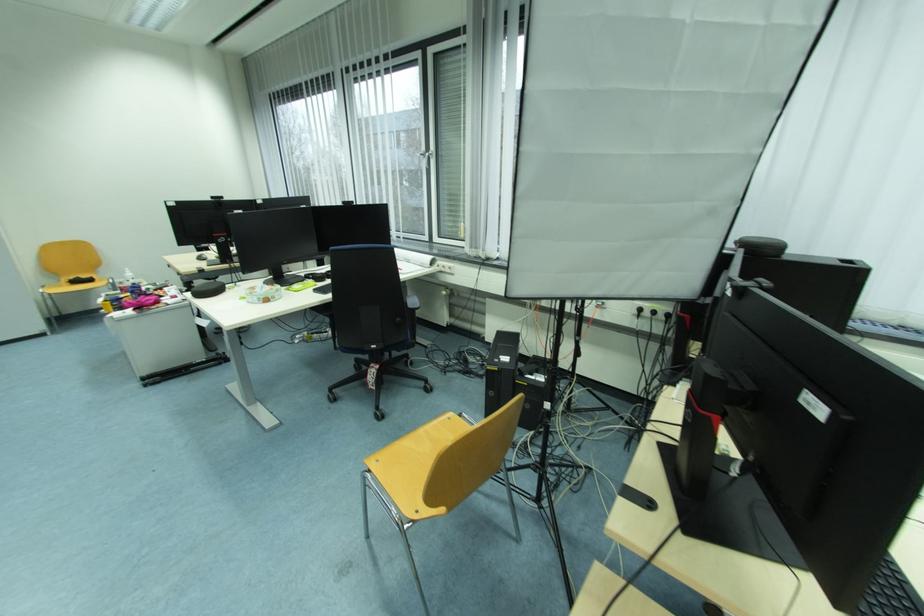
Locate an element on the screen. The width and height of the screenshot is (924, 616). black computer mouse is located at coordinates (80, 280).